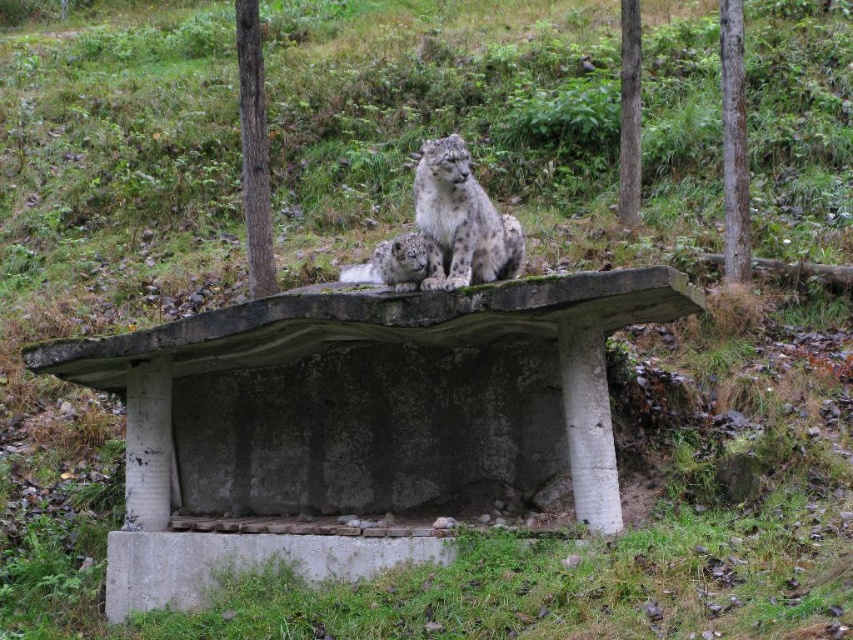
Question: Among these points, which one is farthest from the camera?

Choices:
 (A) (276, 404)
 (B) (744, 150)
 (C) (628, 49)

Answer: (C)

Question: Which object is farther from the camera taking this photo?

Choices:
 (A) concrete bench at center
 (B) smooth bark tree at right

Answer: (B)

Question: Which object is closer to the camera taking this photo?

Choices:
 (A) brown rough bark tree at right
 (B) smooth bark tree at right
 (C) white fur snow leopard at center
 (D) smooth brown tree trunk at center

Answer: (C)

Question: Is white fur snow leopard at center below smooth brown tree trunk at center?

Choices:
 (A) yes
 (B) no

Answer: (A)

Question: Is concrete bench at center to the right of smooth bark tree at right from the viewer's perspective?

Choices:
 (A) no
 (B) yes

Answer: (A)

Question: In this image, where is white fur snow leopard at center located relative to smooth brown tree trunk at center?

Choices:
 (A) left
 (B) right

Answer: (B)